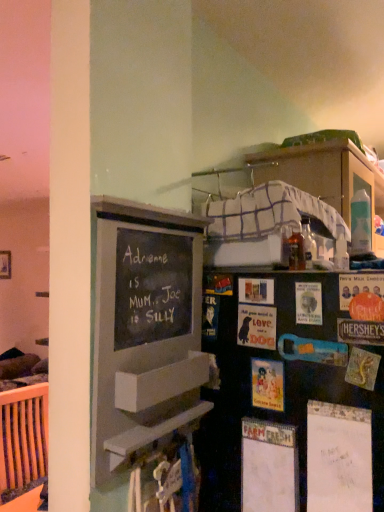
Locate an element on the screen. This screenshot has width=384, height=512. black matte bookshelf at center is located at coordinates (290, 341).

Where is `matte cardboard postcard at right, which is counted as the first postcard, starting from the right`? matte cardboard postcard at right, which is counted as the first postcard, starting from the right is located at coordinates (359, 286).

Locate an element on the screen. black matte bookshelf at center is located at coordinates (290, 341).

How different are the orientations of matte paper postcard at center, which appears as the 3th postcard when viewed from the right, and black matte bookshelf at center in degrees?

The angular difference between matte paper postcard at center, which appears as the 3th postcard when viewed from the right, and black matte bookshelf at center is 90 degrees.

Which is in front, point (262, 379) or point (296, 355)?

The point (296, 355) is in front.

In the image, is matte paper postcard at center, positioned as the 2th postcard in left-to-right order, on the left side or the right side of black matte bookshelf at center?

Clearly, matte paper postcard at center, positioned as the 2th postcard in left-to-right order, is on the left of black matte bookshelf at center in the image.

Between matte paper postcard at center, which appears as the 3th postcard when viewed from the right, and black matte bookshelf at center, which one has less height?

With less height is matte paper postcard at center, which appears as the 3th postcard when viewed from the right.

From the picture: From the image's perspective, is matte cardboard postcard at right, which is the fourth postcard from left to right, below matte paper postcard at center-right, which appears as the second postcard when viewed from the right?

Incorrect, from the image's perspective, matte cardboard postcard at right, which is the fourth postcard from left to right, is higher than matte paper postcard at center-right, which appears as the second postcard when viewed from the right.

I want to click on postcard on the right of matte paper postcard at center-right, positioned as the 3th postcard in left-to-right order, so click(x=359, y=286).

Does matte cardboard postcard at right, which is counted as the first postcard, starting from the right, turn towards matte paper postcard at center-right, positioned as the 3th postcard in left-to-right order?

No, matte cardboard postcard at right, which is counted as the first postcard, starting from the right, is not turned towards matte paper postcard at center-right, positioned as the 3th postcard in left-to-right order.

Considering the positions of objects matte cardboard postcard at right, which is counted as the first postcard, starting from the right, and matte paper postcard at center-right, which appears as the second postcard when viewed from the right, in the image provided, who is more to the left, matte cardboard postcard at right, which is counted as the first postcard, starting from the right, or matte paper postcard at center-right, which appears as the second postcard when viewed from the right,?

matte paper postcard at center-right, which appears as the second postcard when viewed from the right.

Which postcard is the 2nd one when counting from the front of the matte paper postcard at center, acting as the 4th postcard starting from the right? Please provide its 2D coordinates.

[(308, 303)]

Is point (268, 323) positioned after point (321, 320)?

Yes, it is behind point (321, 320).

Is matte paper postcard at center, marked as the 1th postcard in a left-to-right arrangement, to the right of matte paper postcard at center-right, positioned as the 3th postcard in left-to-right order, from the viewer's perspective?

No.

Is matte cardboard postcard at right, which is counted as the first postcard, starting from the right, directly adjacent to black matte bookshelf at center?

They are not placed beside each other.

Is matte cardboard postcard at right, which is the fourth postcard from left to right, located outside black matte bookshelf at center?

No.

What's the angular difference between matte cardboard postcard at right, which is the fourth postcard from left to right, and black matte bookshelf at center's facing directions?

The facing directions of matte cardboard postcard at right, which is the fourth postcard from left to right, and black matte bookshelf at center are 90 degrees apart.

From the image's perspective, is matte cardboard postcard at right, which is counted as the first postcard, starting from the right, over black matte bookshelf at center?

Yes, from the image's perspective, matte cardboard postcard at right, which is counted as the first postcard, starting from the right, is on top of black matte bookshelf at center.

This screenshot has height=512, width=384. I want to click on the 1st postcard above the chalkboard paint bulletin board at left (from the image's perspective), so click(x=308, y=303).

From a real-world perspective, which is physically below, chalkboard paint bulletin board at left or matte paper postcard at center-right, positioned as the 3th postcard in left-to-right order?

chalkboard paint bulletin board at left.

Can you tell me how much chalkboard paint bulletin board at left and matte paper postcard at center-right, which appears as the second postcard when viewed from the right, differ in facing direction?

The facing directions of chalkboard paint bulletin board at left and matte paper postcard at center-right, which appears as the second postcard when viewed from the right, are 89.9 degrees apart.

Is chalkboard paint bulletin board at left further to the viewer compared to matte paper postcard at center-right, positioned as the 3th postcard in left-to-right order?

No, it is not.

How far apart are matte paper postcard at center-right, positioned as the 3th postcard in left-to-right order, and matte cardboard postcard at right, which is the fourth postcard from left to right?

matte paper postcard at center-right, positioned as the 3th postcard in left-to-right order, is 2.51 inches from matte cardboard postcard at right, which is the fourth postcard from left to right.

Between matte paper postcard at center-right, positioned as the 3th postcard in left-to-right order, and matte cardboard postcard at right, which is counted as the first postcard, starting from the right, which one has more height?

matte paper postcard at center-right, positioned as the 3th postcard in left-to-right order.

From the image's perspective, is matte paper postcard at center-right, which appears as the second postcard when viewed from the right, on matte cardboard postcard at right, which is the fourth postcard from left to right?

No, from the image's perspective, matte paper postcard at center-right, which appears as the second postcard when viewed from the right, is not on top of matte cardboard postcard at right, which is the fourth postcard from left to right.

Can you confirm if matte paper postcard at center-right, which appears as the second postcard when viewed from the right, is positioned to the left of matte cardboard postcard at right, which is counted as the first postcard, starting from the right?

Correct, you'll find matte paper postcard at center-right, which appears as the second postcard when viewed from the right, to the left of matte cardboard postcard at right, which is counted as the first postcard, starting from the right.

Considering the sizes of matte paper postcard at center, positioned as the 2th postcard in left-to-right order, and matte paper postcard at center-right, positioned as the 3th postcard in left-to-right order, in the image, is matte paper postcard at center, positioned as the 2th postcard in left-to-right order, bigger or smaller than matte paper postcard at center-right, positioned as the 3th postcard in left-to-right order,?

Considering their sizes, matte paper postcard at center, positioned as the 2th postcard in left-to-right order, takes up more space than matte paper postcard at center-right, positioned as the 3th postcard in left-to-right order.

Considering the relative sizes of matte paper postcard at center, which appears as the 3th postcard when viewed from the right, and matte paper postcard at center-right, which appears as the second postcard when viewed from the right, in the image provided, is matte paper postcard at center, which appears as the 3th postcard when viewed from the right, thinner than matte paper postcard at center-right, which appears as the second postcard when viewed from the right,?

Yes, matte paper postcard at center, which appears as the 3th postcard when viewed from the right, is thinner than matte paper postcard at center-right, which appears as the second postcard when viewed from the right.

How different are the orientations of matte paper postcard at center, which appears as the 3th postcard when viewed from the right, and matte paper postcard at center-right, which appears as the second postcard when viewed from the right, in degrees?

The angular difference between matte paper postcard at center, which appears as the 3th postcard when viewed from the right, and matte paper postcard at center-right, which appears as the second postcard when viewed from the right, is 0.0139 degrees.

Considering the positions of objects matte paper postcard at center, which appears as the 3th postcard when viewed from the right, and matte paper postcard at center-right, which appears as the second postcard when viewed from the right, in the image provided, who is behind, matte paper postcard at center, which appears as the 3th postcard when viewed from the right, or matte paper postcard at center-right, which appears as the second postcard when viewed from the right,?

matte paper postcard at center, which appears as the 3th postcard when viewed from the right, is further away from the camera.

From a real-world perspective, starting from the black matte bookshelf at center, which postcard is the 1st one vertically above it? Please provide its 2D coordinates.

[(267, 384)]

Where is `the 1st postcard behind the matte cardboard postcard at right, which is the fourth postcard from left to right`? the 1st postcard behind the matte cardboard postcard at right, which is the fourth postcard from left to right is located at coordinates (308, 303).

Considering their positions, is matte cardboard postcard at right, which is the fourth postcard from left to right, positioned further to matte paper postcard at center, positioned as the 2th postcard in left-to-right order, than chalkboard paint bulletin board at left?

chalkboard paint bulletin board at left lies further to matte paper postcard at center, positioned as the 2th postcard in left-to-right order, than the other object.

Considering their positions, is matte paper postcard at center, acting as the 4th postcard starting from the right, positioned closer to chalkboard paint bulletin board at left than matte paper postcard at center, positioned as the 2th postcard in left-to-right order?

Based on the image, matte paper postcard at center, acting as the 4th postcard starting from the right, appears to be nearer to chalkboard paint bulletin board at left.

Which object lies further to the anchor point matte paper postcard at center, marked as the 1th postcard in a left-to-right arrangement, matte paper postcard at center-right, positioned as the 3th postcard in left-to-right order, or matte cardboard postcard at right, which is counted as the first postcard, starting from the right?

Among the two, matte cardboard postcard at right, which is counted as the first postcard, starting from the right, is located further to matte paper postcard at center, marked as the 1th postcard in a left-to-right arrangement.

When comparing their distances from matte paper postcard at center-right, which appears as the second postcard when viewed from the right, does black matte bookshelf at center or matte paper postcard at center, which appears as the 3th postcard when viewed from the right, seem closer?

Among the two, matte paper postcard at center, which appears as the 3th postcard when viewed from the right, is located nearer to matte paper postcard at center-right, which appears as the second postcard when viewed from the right.

Looking at the image, which one is located further to matte paper postcard at center, positioned as the 2th postcard in left-to-right order, black matte bookshelf at center or matte paper postcard at center, acting as the 4th postcard starting from the right?

black matte bookshelf at center is further to matte paper postcard at center, positioned as the 2th postcard in left-to-right order.

Looking at the image, which one is located closer to matte paper postcard at center, positioned as the 2th postcard in left-to-right order, matte cardboard postcard at right, which is counted as the first postcard, starting from the right, or black matte bookshelf at center?

matte cardboard postcard at right, which is counted as the first postcard, starting from the right, is closer to matte paper postcard at center, positioned as the 2th postcard in left-to-right order.

Estimate the real-world distances between objects in this image. Which object is closer to chalkboard paint bulletin board at left, matte cardboard postcard at right, which is the fourth postcard from left to right, or matte paper postcard at center, positioned as the 2th postcard in left-to-right order?

Based on the image, matte paper postcard at center, positioned as the 2th postcard in left-to-right order, appears to be nearer to chalkboard paint bulletin board at left.

Looking at this image, considering their positions, is matte cardboard postcard at right, which is counted as the first postcard, starting from the right, positioned further to matte paper postcard at center, marked as the 1th postcard in a left-to-right arrangement, than matte paper postcard at center-right, which appears as the second postcard when viewed from the right?

matte cardboard postcard at right, which is counted as the first postcard, starting from the right, is further to matte paper postcard at center, marked as the 1th postcard in a left-to-right arrangement.

Locate an element on the screen. bulletin board between matte cardboard postcard at right, which is counted as the first postcard, starting from the right, and black matte bookshelf at center, in the vertical direction is located at coordinates (143, 330).

Image resolution: width=384 pixels, height=512 pixels. Find the location of `postcard between matte paper postcard at center, marked as the 1th postcard in a left-to-right arrangement, and black matte bookshelf at center vertically`. postcard between matte paper postcard at center, marked as the 1th postcard in a left-to-right arrangement, and black matte bookshelf at center vertically is located at coordinates (267, 384).

Locate an element on the screen. The height and width of the screenshot is (512, 384). postcard that lies between matte paper postcard at center-right, positioned as the 3th postcard in left-to-right order, and matte paper postcard at center, which appears as the 3th postcard when viewed from the right, from top to bottom is located at coordinates (257, 326).

Identify the location of bulletin board between matte paper postcard at center-right, positioned as the 3th postcard in left-to-right order, and black matte bookshelf at center vertically. (143, 330).